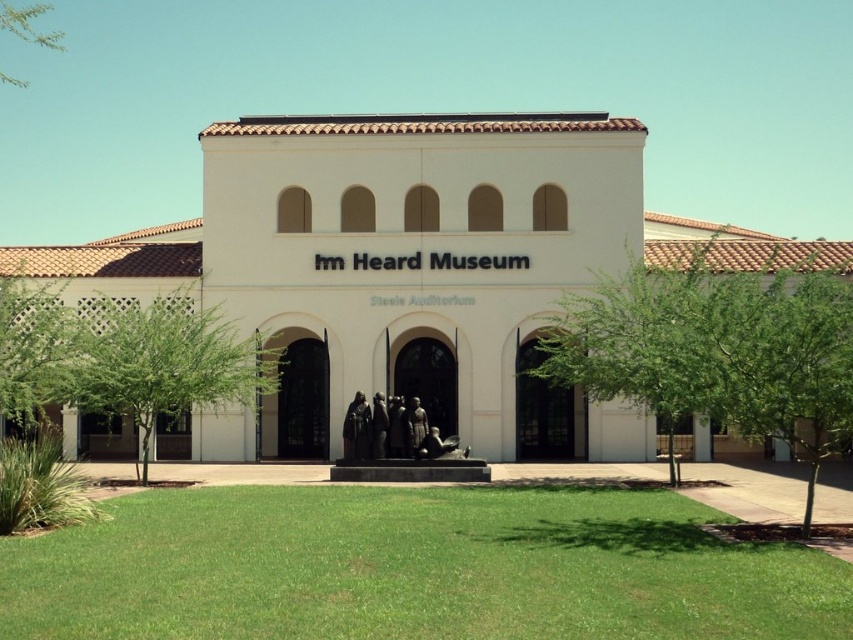
Question: Estimate the real-world distances between objects in this image. Which object is farther from the green grass at lower center?

Choices:
 (A) green leafy tree at center
 (B) green leafy tree at lower left
 (C) green leafy tree at left
 (D) green leafy tree at upper left

Answer: (D)

Question: Does green leafy tree at left appear on the left side of green leafy tree at upper left?

Choices:
 (A) no
 (B) yes

Answer: (A)

Question: Which of the following is the farthest from the observer?

Choices:
 (A) green leafy tree at left
 (B) green leafy tree at upper left
 (C) green grass at lower center

Answer: (B)

Question: Is green leafy tree at center smaller than green leafy tree at lower left?

Choices:
 (A) no
 (B) yes

Answer: (A)

Question: Estimate the real-world distances between objects in this image. Which object is closer to the green grass at lower center?

Choices:
 (A) green leafy tree at center
 (B) green leafy tree at left
 (C) green leafy tree at lower left

Answer: (A)

Question: Does green leafy tree at center have a lesser width compared to green leafy tree at left?

Choices:
 (A) yes
 (B) no

Answer: (B)